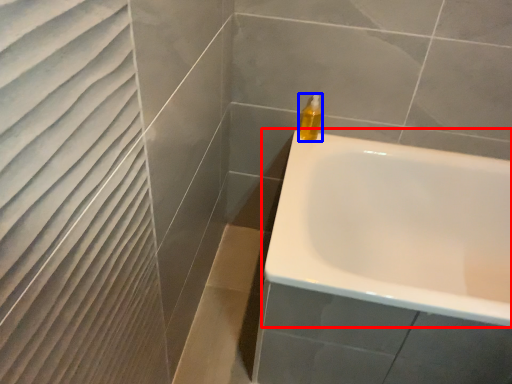
Question: Among these objects, which one is nearest to the camera, bathtub (highlighted by a red box) or soap dispenser (highlighted by a blue box)?

Choices:
 (A) bathtub
 (B) soap dispenser

Answer: (A)